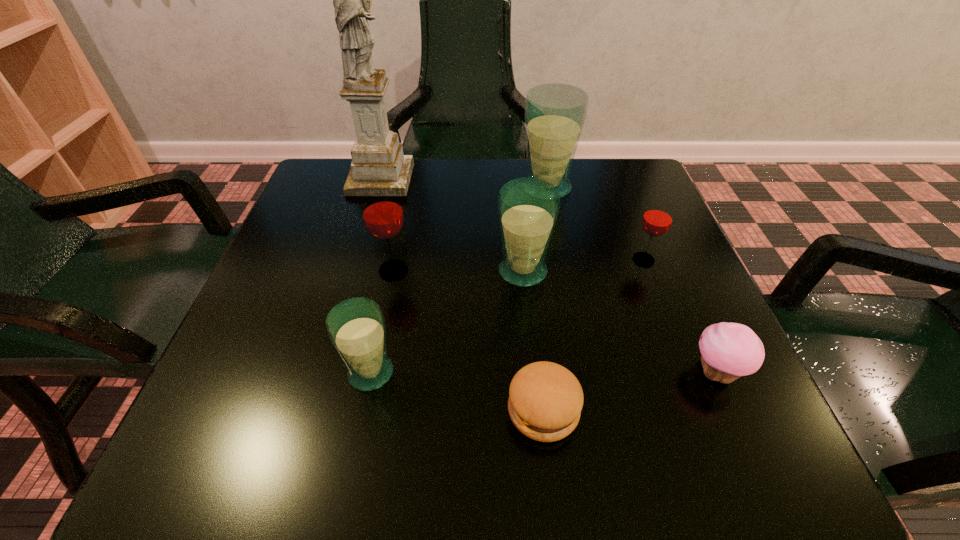
This screenshot has height=540, width=960. I want to click on vacant space at the near edge of the desktop, so click(x=660, y=454).

Find the location of a particular element. The image size is (960, 540). vacant area at the left edge of the desktop is located at coordinates (303, 248).

Where is `free space at the right edge`? free space at the right edge is located at coordinates (676, 341).

Where is `vacant area at the far right corner of the desktop`? vacant area at the far right corner of the desktop is located at coordinates (599, 178).

In the image, there is a desktop. At what (x,y) coordinates should I click in order to perform the action: click on vacant space at the near right corner. Please return your answer as a coordinate pair (x, y). The image size is (960, 540). Looking at the image, I should click on (674, 425).

Where is `vacant area that lies between the second biggest blue glass and the cupcake`? vacant area that lies between the second biggest blue glass and the cupcake is located at coordinates (619, 322).

The width and height of the screenshot is (960, 540). Find the location of `vacant space in between the nearest blue glass and the biggest blue glass`. vacant space in between the nearest blue glass and the biggest blue glass is located at coordinates (459, 280).

Find the location of a particular element. empty space between the shortest object and the right red glass is located at coordinates (593, 335).

The height and width of the screenshot is (540, 960). I want to click on free spot between the bigger red glass and the biggest blue glass, so click(470, 229).

At what (x,y) coordinates should I click in order to perform the action: click on unoccupied position between the second farthest blue glass and the tallest object. Please return your answer as a coordinate pair (x, y). The image size is (960, 540). Looking at the image, I should click on (452, 225).